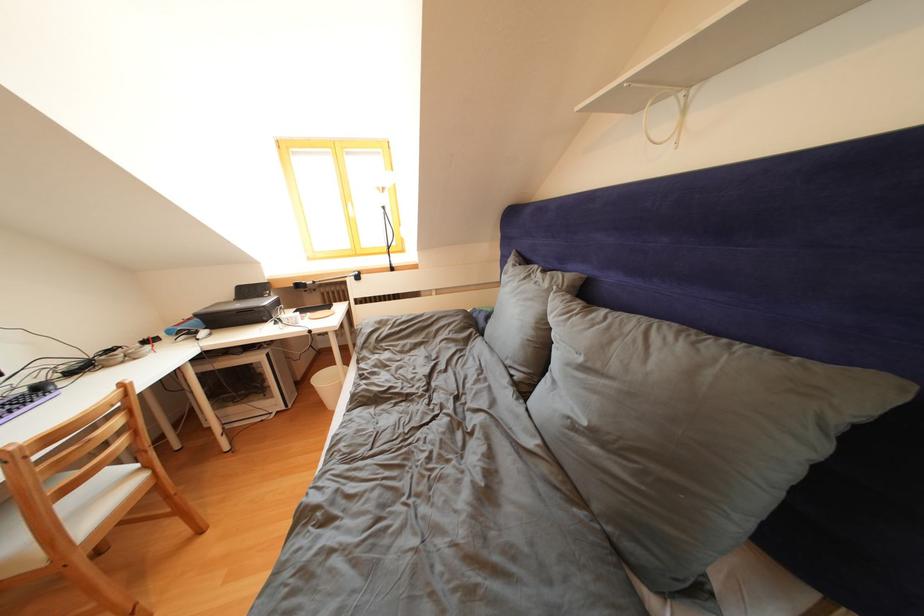
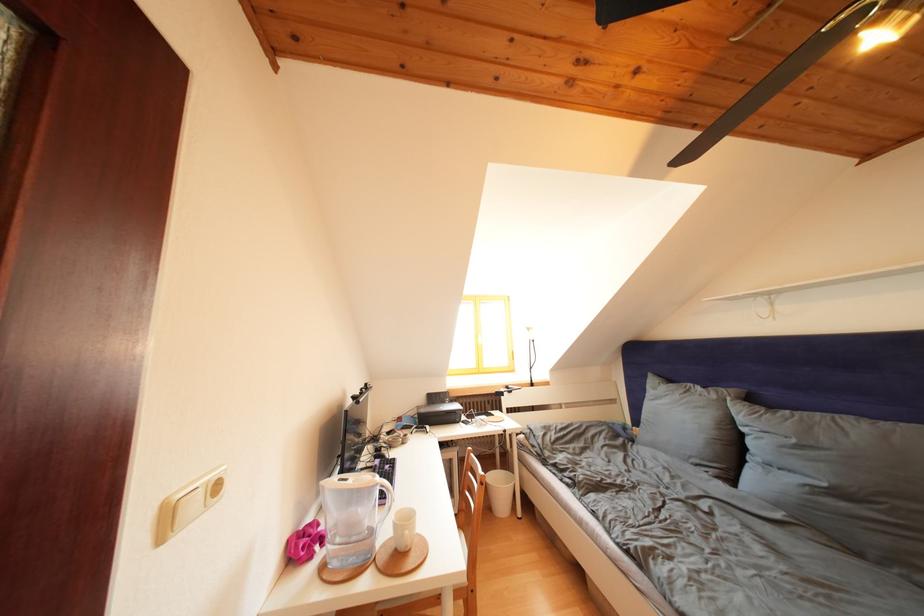
Locate, in the second image, the point that corresponds to (553,290) in the first image.

(722, 402)